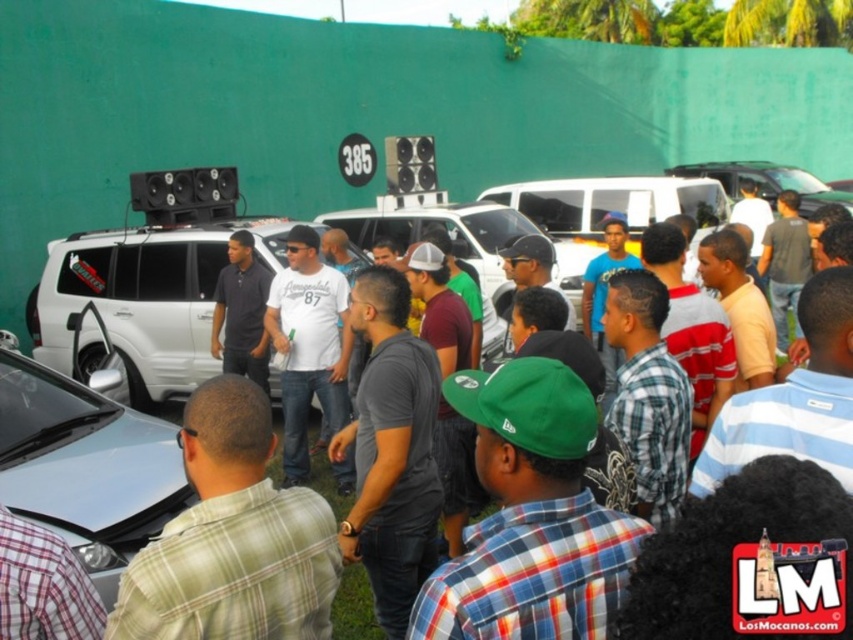
Question: Observing the image, what is the correct spatial positioning of green fabric cap at center in reference to satin silver car at lower left?

Choices:
 (A) below
 (B) above

Answer: (B)

Question: Can you confirm if green fabric cap at center is positioned to the left of gray matte shirt at center?

Choices:
 (A) yes
 (B) no

Answer: (B)

Question: Which of the following is the closest to the observer?

Choices:
 (A) (369, 314)
 (B) (804, 209)
 (C) (180, 502)

Answer: (A)

Question: Which point appears closest to the camera in this image?

Choices:
 (A) 113,326
 (B) 20,416
 (C) 229,237

Answer: (B)

Question: Which of the following is the closest to the observer?

Choices:
 (A) (744, 172)
 (B) (496, 483)
 (C) (244, 333)

Answer: (B)

Question: From the image, what is the correct spatial relationship of white matte shirt at center in relation to white matte suv at upper left?

Choices:
 (A) right
 (B) left

Answer: (B)